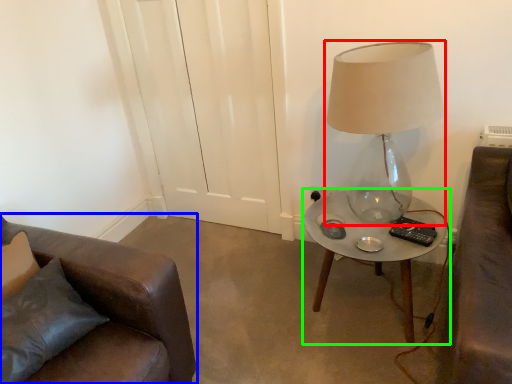
Question: Which object is the closest to the lamp (highlighted by a red box)? Choose among these: chair (highlighted by a blue box) or table (highlighted by a green box).

Choices:
 (A) chair
 (B) table

Answer: (B)